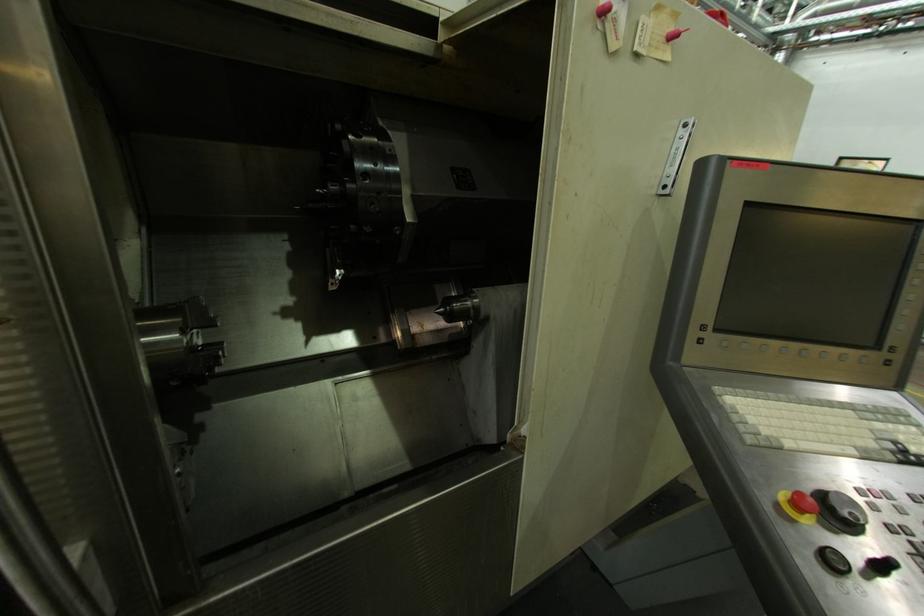
Find the location of a particular element. The image size is (924, 616). red emergency button is located at coordinates (797, 506).